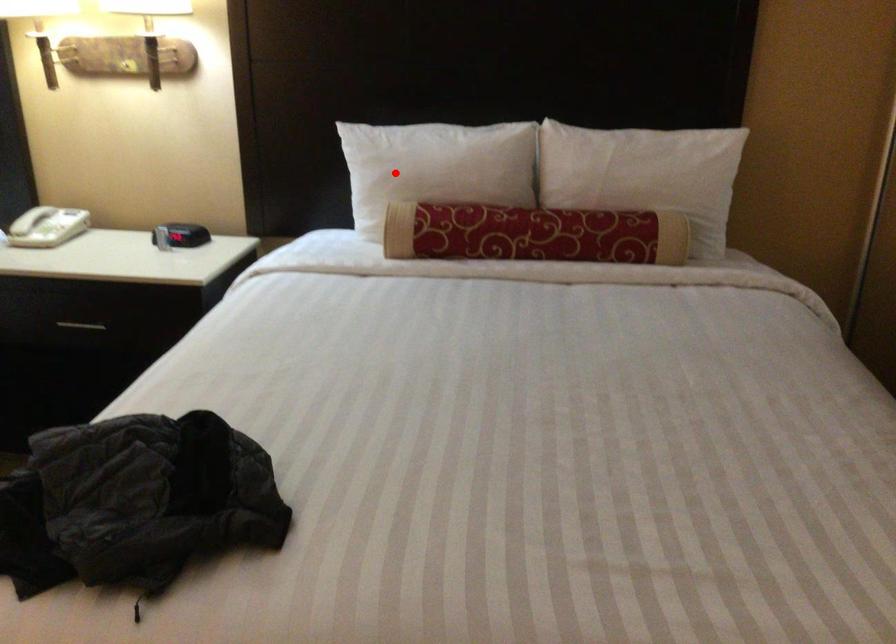
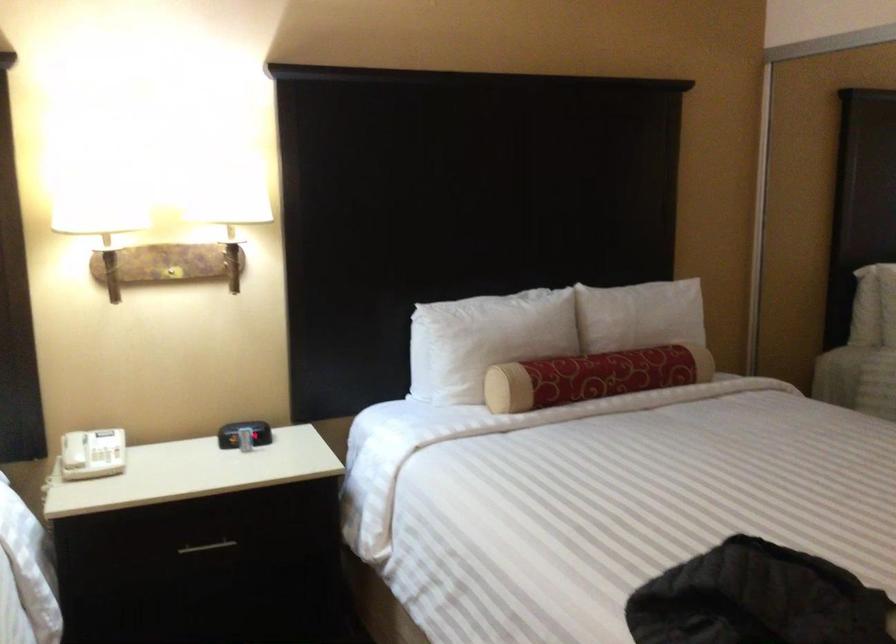
Question: I am providing you with two images of the same scene from different viewpoints. In image1, a red point is highlighted. Considering the same 3D point in image2, which of the following is correct?

Choices:
 (A) It is closer
 (B) It is farther

Answer: (B)